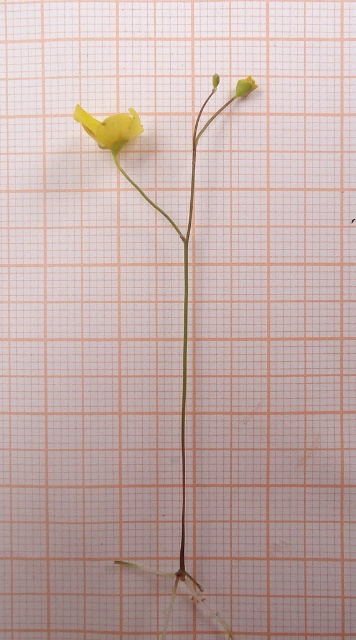
Can you confirm if yellow matte flower at center is taller than green matte flower at upper right?

Indeed, yellow matte flower at center has a greater height compared to green matte flower at upper right.

Does yellow matte flower at center appear under green matte flower at upper right?

Indeed, yellow matte flower at center is positioned under green matte flower at upper right.

Is point (184, 518) in front of point (248, 93)?

No, it is not.

What are the coordinates of `yellow matte flower at center` in the screenshot? It's located at (182, 376).

Looking at this image, between matte yellow flower at upper left and green matte flower at upper right, which one appears on the left side from the viewer's perspective?

From the viewer's perspective, matte yellow flower at upper left appears more on the left side.

Is matte yellow flower at upper left to the right of green matte flower at upper right from the viewer's perspective?

In fact, matte yellow flower at upper left is to the left of green matte flower at upper right.

Measure the distance between point [131,129] and camera.

Point [131,129] and camera are 4.05 feet apart from each other.

Where is `matte yellow flower at upper left`? This screenshot has height=640, width=356. matte yellow flower at upper left is located at coordinates pos(110,129).

Does yellow matte flower at center come in front of matte yellow flower at upper left?

No, it is not.

Does yellow matte flower at center have a lesser width compared to matte yellow flower at upper left?

In fact, yellow matte flower at center might be wider than matte yellow flower at upper left.

Which is behind, point (201, 104) or point (72, 115)?

Point (201, 104)

This screenshot has width=356, height=640. Find the location of `yellow matte flower at center`. yellow matte flower at center is located at coordinates (182, 376).